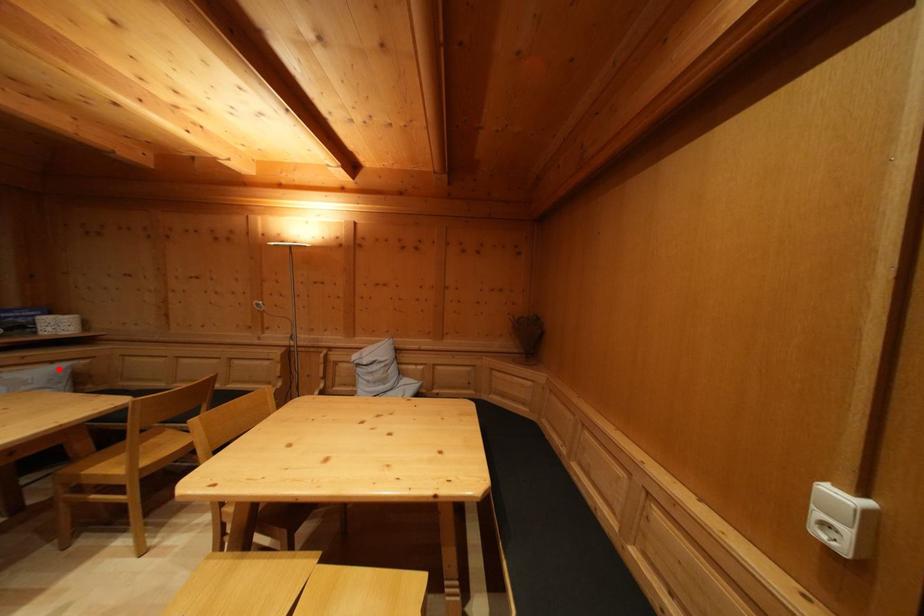
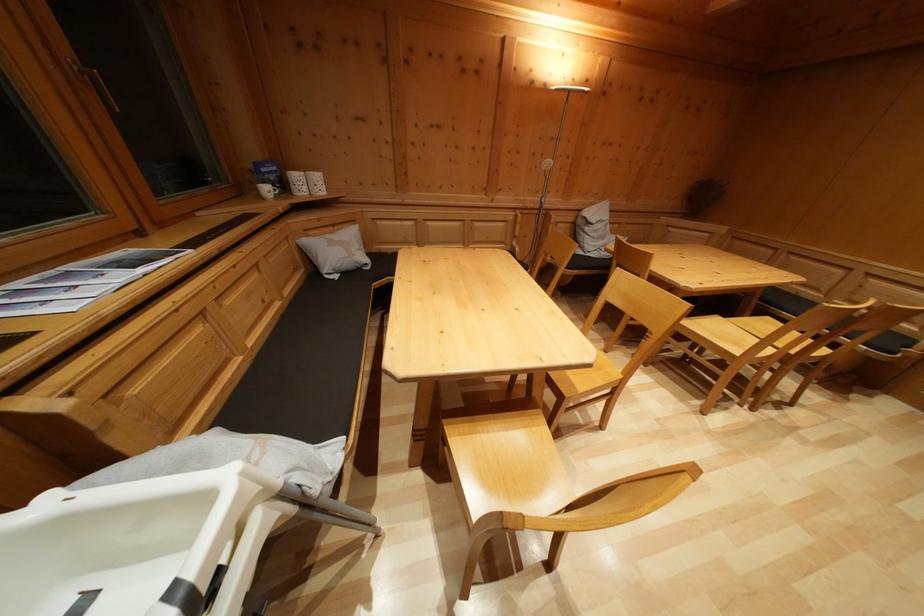
Question: I am providing you with two images of the same scene from different viewpoints. Image1 has a red point marked. In image2, the corresponding 3D location appears at what relative position? Reply with the corresponding letter.

Choices:
 (A) Closer
 (B) Farther

Answer: (A)